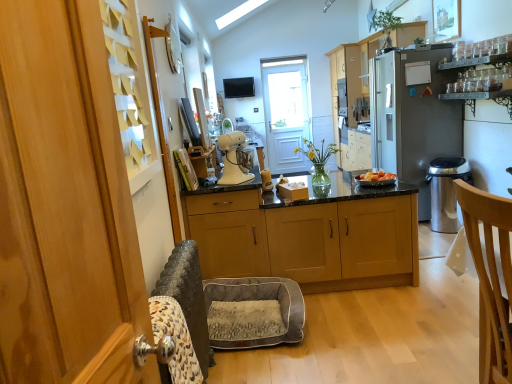
At what (x,y) coordinates should I click in order to perform the action: click on free space in front of gray fabric cat bed at lower left. Please return your answer as a coordinate pair (x, y). The height and width of the screenshot is (384, 512). Looking at the image, I should click on (280, 363).